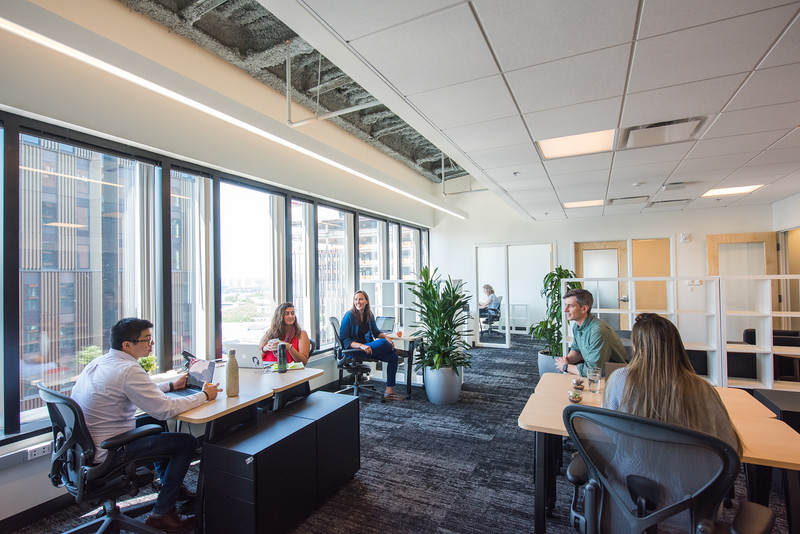
Where is `desk`? The image size is (800, 534). desk is located at coordinates (217, 400), (272, 367), (406, 334), (534, 409), (554, 374).